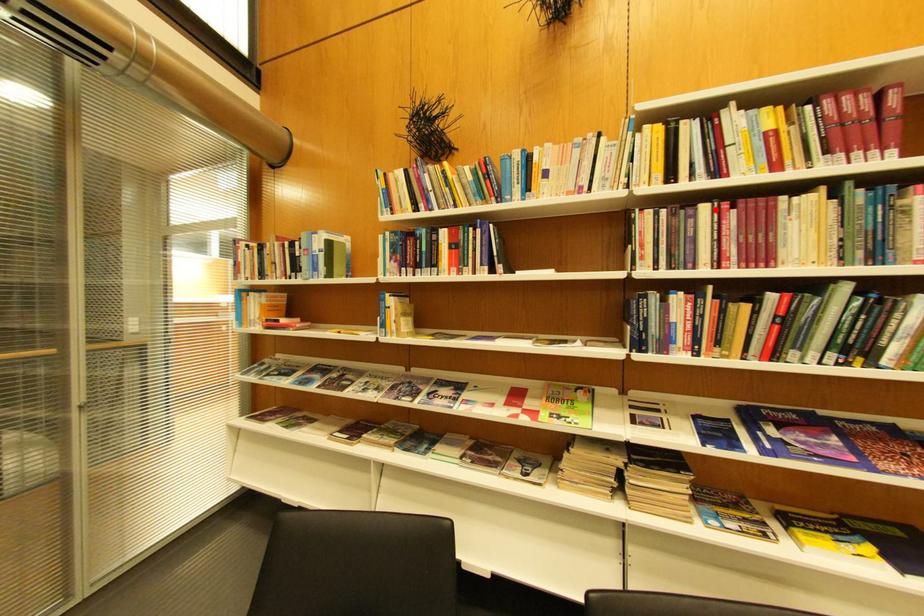
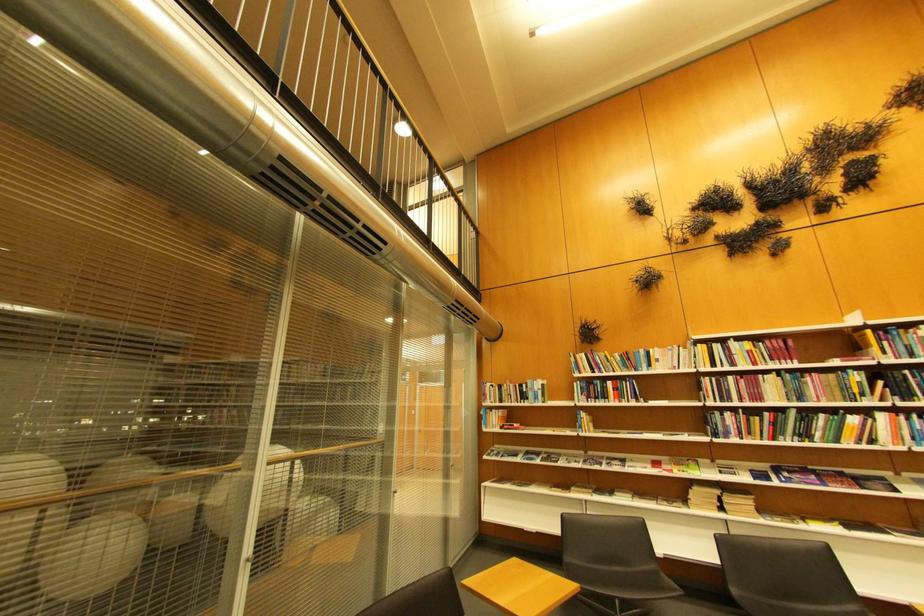
Find the pixel in the second image that matches the highlighted location in the first image.

(740, 379)